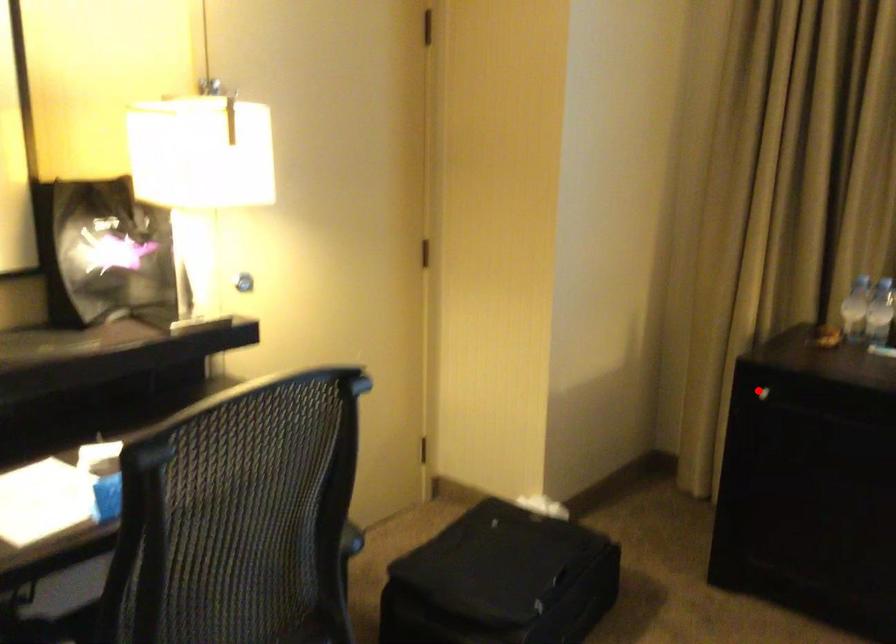
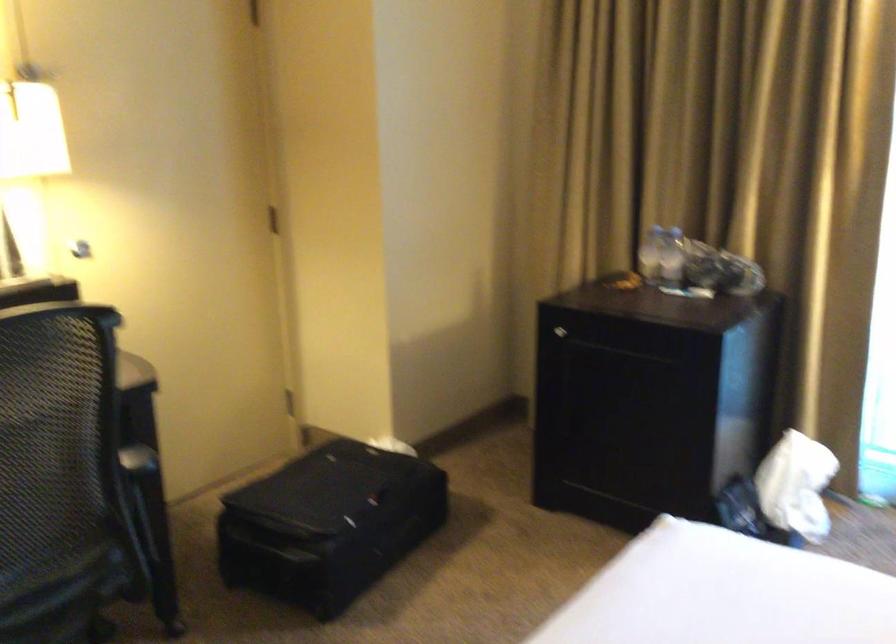
The point at the highlighted location is marked in the first image. Where is the corresponding point in the second image?

(560, 330)